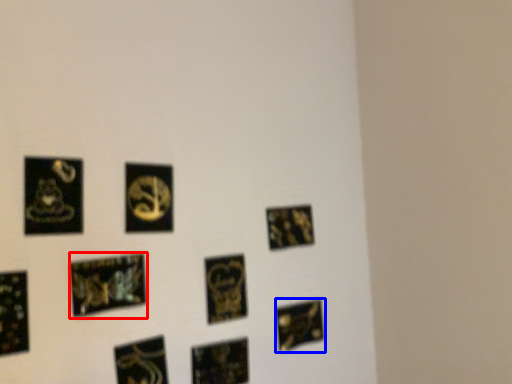
Question: Which object appears farthest to the camera in this image, picture frame (highlighted by a red box) or picture frame (highlighted by a blue box)?

Choices:
 (A) picture frame
 (B) picture frame

Answer: (B)